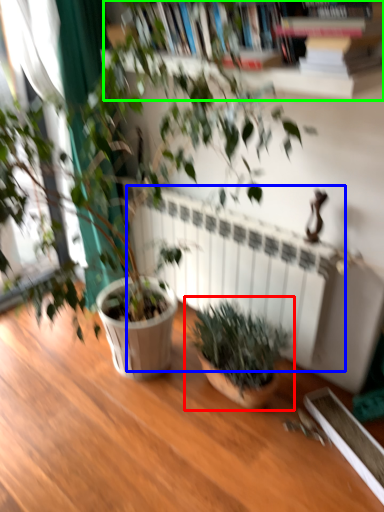
Question: Which is farther away from houseplant (highlighted by a red box)? radiator (highlighted by a blue box) or bookcase (highlighted by a green box)?

Choices:
 (A) radiator
 (B) bookcase

Answer: (B)